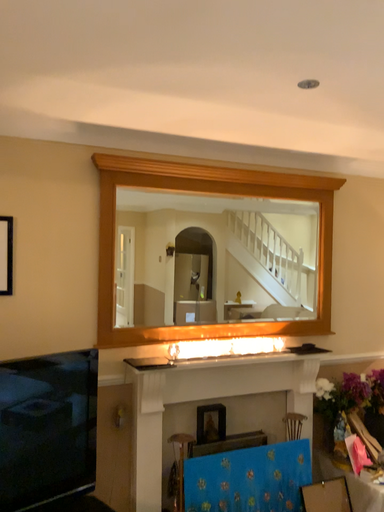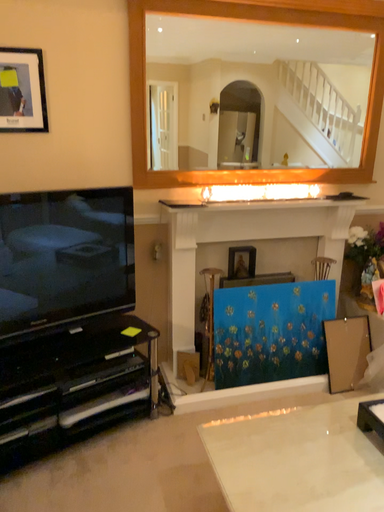
Question: Which way did the camera rotate in the video?

Choices:
 (A) rotated upward
 (B) rotated downward

Answer: (B)